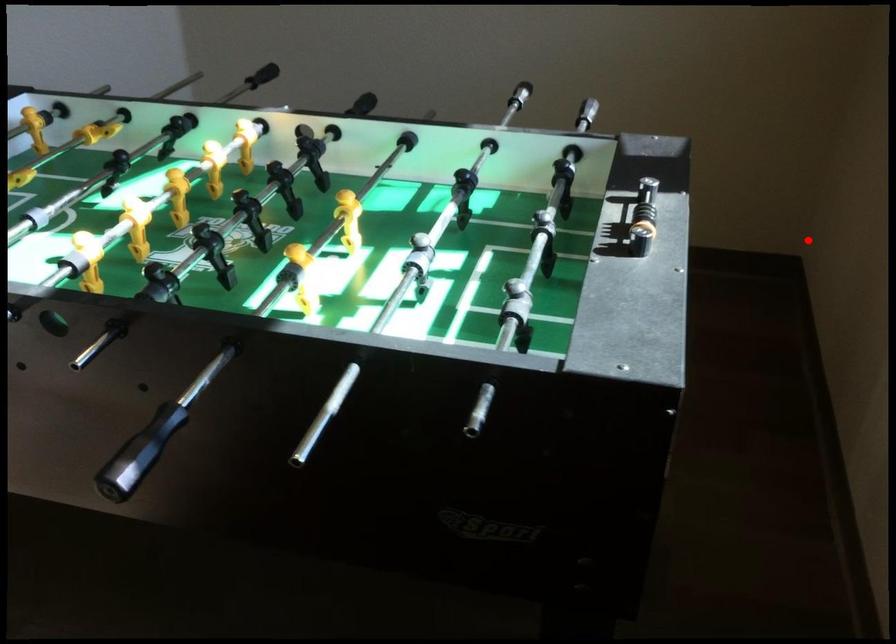
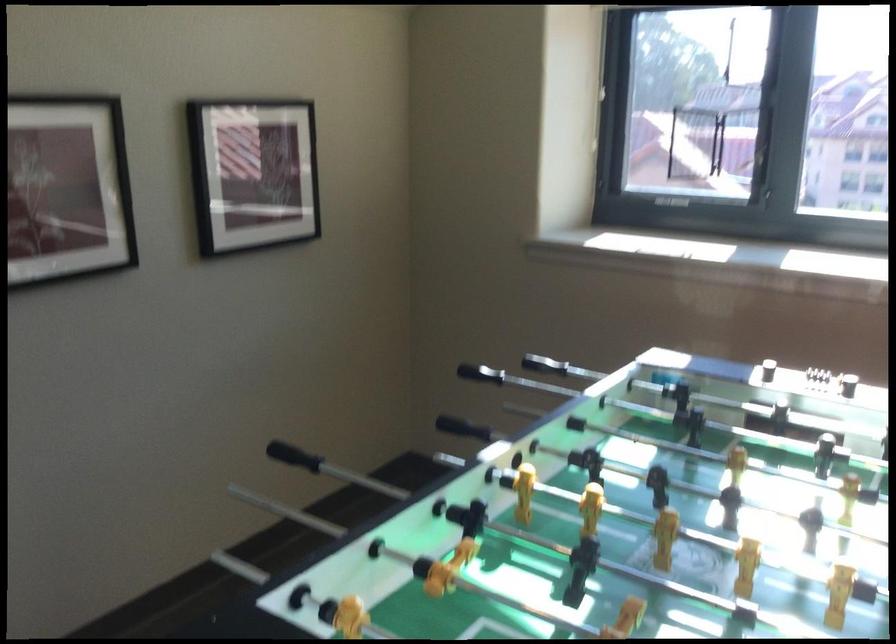
Where in the second image is the point corresponding to the highlighted location from the first image?

(463, 428)